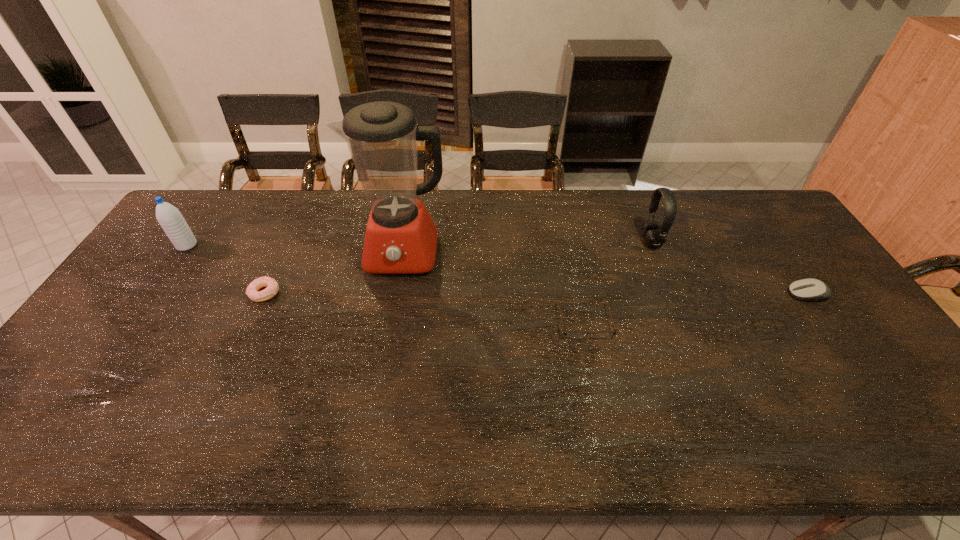
Identify the location of vacant position located 0.370m on the front-facing side of the fifth object from left to right. (527, 241).

Image resolution: width=960 pixels, height=540 pixels. I want to click on vacant space located 0.320m on the front-facing side of the fifth object from left to right, so click(543, 241).

The height and width of the screenshot is (540, 960). Identify the location of vacant point located 0.370m on the right of the leftmost object. tap(312, 246).

Identify the location of vacant space located 0.370m on the wheel side of the fourth tallest object. The image size is (960, 540). (660, 295).

Image resolution: width=960 pixels, height=540 pixels. What are the coordinates of `vacant area located 0.220m on the wheel side of the fourth tallest object` in the screenshot? It's located at click(x=711, y=295).

Locate an element on the screen. vacant space located 0.370m on the wheel side of the fourth tallest object is located at coordinates (660, 295).

You are a GUI agent. You are given a task and a screenshot of the screen. Output one action in this format:
    pyautogui.click(x=<x>, y=<y>)
    Task: Click on the free space located on the back of the doughnut
    This screenshot has height=540, width=960.
    Given the screenshot: What is the action you would take?
    pyautogui.click(x=280, y=259)

You are a GUI agent. You are given a task and a screenshot of the screen. Output one action in this format:
    pyautogui.click(x=<x>, y=<y>)
    Task: Click on the free spot located 0.080m on the front-facing side of the fourth object from left to right
    The image size is (960, 540).
    Given the screenshot: What is the action you would take?
    pyautogui.click(x=594, y=366)

The width and height of the screenshot is (960, 540). Find the location of `blender at the far edge`. blender at the far edge is located at coordinates (401, 238).

At what (x,y) coordinates should I click in order to perform the action: click on headset that is at the far edge. Please return your answer as a coordinate pair (x, y). Looking at the image, I should click on (653, 234).